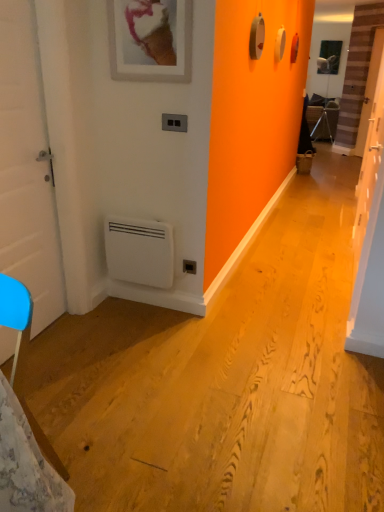
This screenshot has height=512, width=384. What are the coordinates of `free point in front of white matte door at left, acting as the first door starting from the left` in the screenshot? It's located at (49, 376).